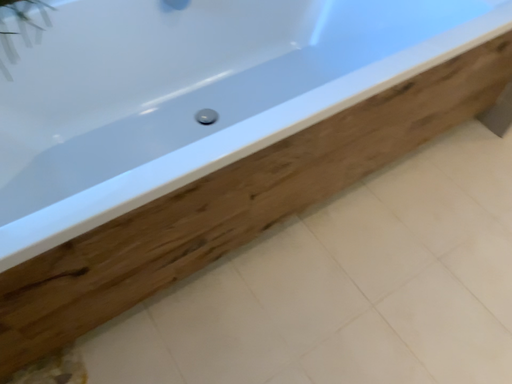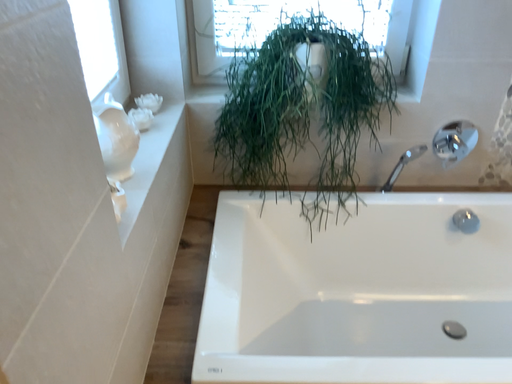
Question: How did the camera likely rotate when shooting the video?

Choices:
 (A) rotated downward
 (B) rotated upward

Answer: (B)